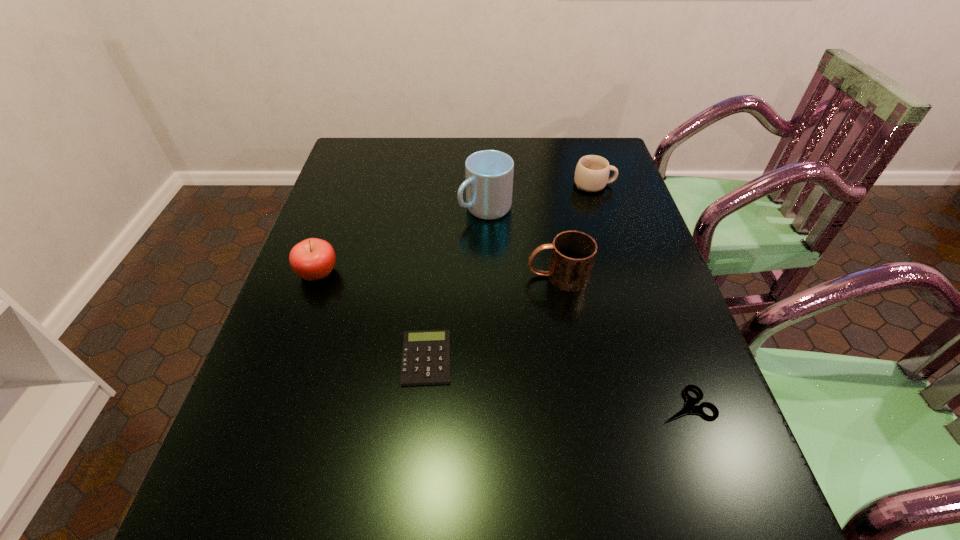
The image size is (960, 540). Find the location of `vacant area that lies between the second tallest mug and the shortest mug`. vacant area that lies between the second tallest mug and the shortest mug is located at coordinates (576, 230).

Identify the location of free space between the tallest mug and the shears. (586, 306).

This screenshot has width=960, height=540. In order to click on unoccupied area between the fourth tallest object and the apple in this screenshot , I will do `click(456, 228)`.

The image size is (960, 540). I want to click on free space that is in between the apple and the second nearest object, so click(x=372, y=316).

Where is `vacant area that lies between the shortest object and the calculator`? vacant area that lies between the shortest object and the calculator is located at coordinates (557, 382).

Identify the location of free area in between the fourth tallest object and the leftmost object. This screenshot has height=540, width=960. (456, 228).

This screenshot has height=540, width=960. What are the coordinates of `free point between the fourth tallest object and the apple` in the screenshot? It's located at (456, 228).

Locate an element on the screen. Image resolution: width=960 pixels, height=540 pixels. free space between the fifth farthest object and the fourth object from left to right is located at coordinates (492, 318).

This screenshot has width=960, height=540. Identify the location of object that is the third closest to the shortest mug. (x=426, y=354).

Locate which object is the second closest to the third shortest object. Please provide its 2D coordinates. Your answer should be formatted as a tuple, i.e. [(x, y)], where the tuple contains the x and y coordinates of a point satisfying the conditions above.

[(573, 253)]